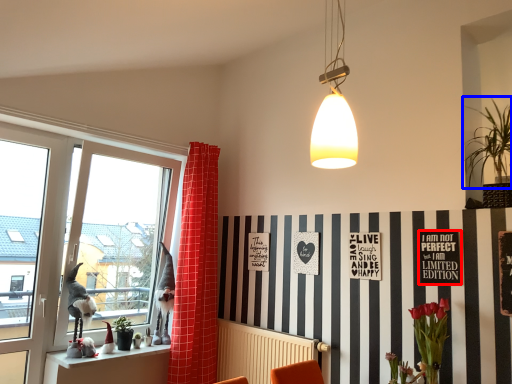
Question: Among these objects, which one is nearest to the camera, bulletin board (highlighted by a red box) or plant (highlighted by a blue box)?

Choices:
 (A) bulletin board
 (B) plant

Answer: (B)